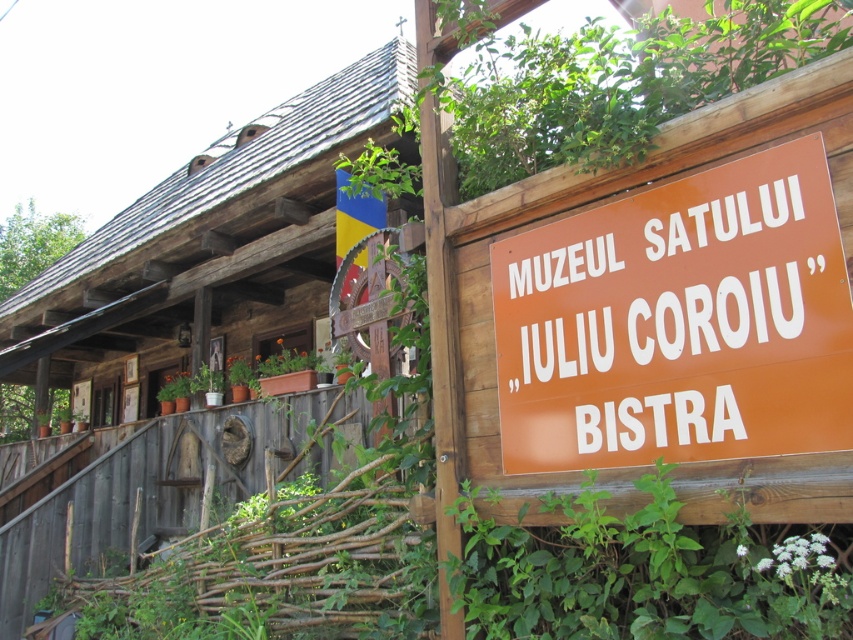
Does brown wooden log cabin at upper left have a lesser width compared to orange matte sign at center?

Incorrect, brown wooden log cabin at upper left's width is not less than orange matte sign at center's.

Is point (306, 460) behind point (567, 426)?

Yes, point (306, 460) is farther from viewer.

Find the location of a particular element. The image size is (853, 640). brown wooden log cabin at upper left is located at coordinates (190, 330).